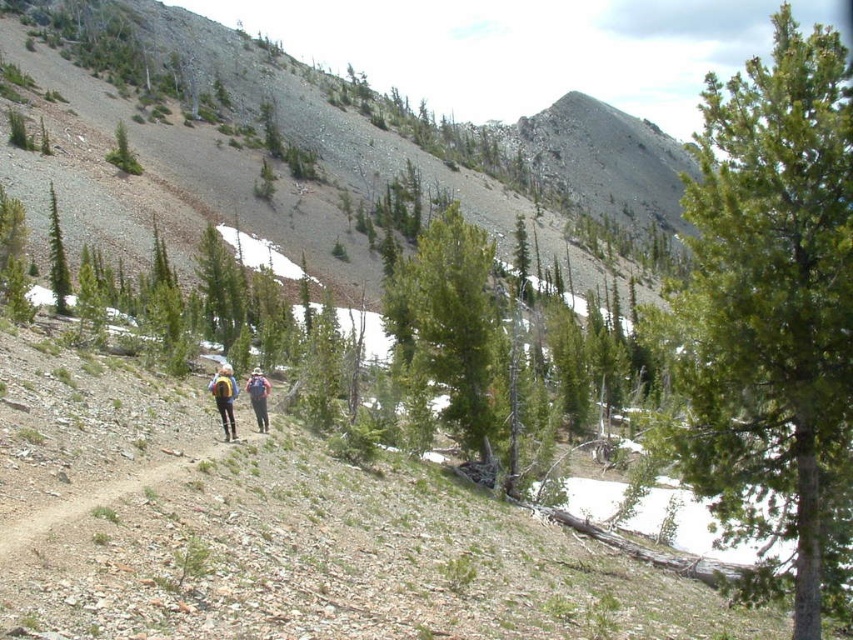
How much distance is there between dirt path at lower center and blue fabric backpack at center?

dirt path at lower center is 40.56 feet from blue fabric backpack at center.

Is point (140, 476) farther from camera compared to point (265, 417)?

No, it is not.

Identify the location of dirt path at lower center. The image size is (853, 640). (97, 499).

Does dirt path at lower center have a smaller size compared to green matte tree at left?

Yes.

Find the location of a particular element. The height and width of the screenshot is (640, 853). dirt path at lower center is located at coordinates (97, 499).

This screenshot has height=640, width=853. Describe the element at coordinates (97, 499) in the screenshot. I see `dirt path at lower center` at that location.

Identify the location of dirt path at lower center. This screenshot has height=640, width=853. (97, 499).

Consider the image. Does matte yellow backpack at center have a lesser height compared to yellow backpack at center?

No, matte yellow backpack at center is not shorter than yellow backpack at center.

Which is behind, point (231, 390) or point (219, 406)?

The point (219, 406) is more distant.

The image size is (853, 640). I want to click on matte yellow backpack at center, so click(x=224, y=397).